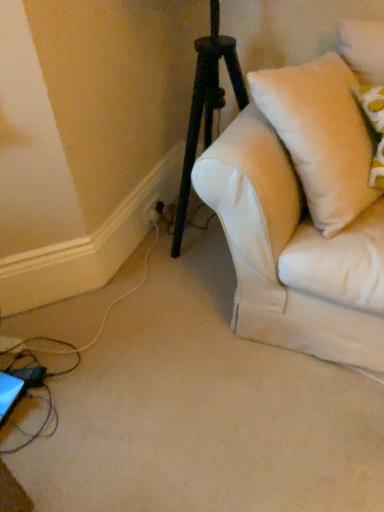
The height and width of the screenshot is (512, 384). I want to click on white plastic electric outlet at lower left, so pyautogui.click(x=153, y=210).

What do you see at coordinates (153, 210) in the screenshot?
I see `white plastic electric outlet at lower left` at bounding box center [153, 210].

What is the approximate width of white plastic electric outlet at lower left?

white plastic electric outlet at lower left is 0.79 inches in width.

At what (x,y) coordinates should I click in order to perform the action: click on white soft pillow at upper right. Please return your answer as a coordinate pair (x, y). The height and width of the screenshot is (512, 384). Looking at the image, I should click on (321, 136).

What do you see at coordinates (321, 136) in the screenshot? I see `white soft pillow at upper right` at bounding box center [321, 136].

The width and height of the screenshot is (384, 512). Find the location of `white plastic electric outlet at lower left`. white plastic electric outlet at lower left is located at coordinates (153, 210).

Consider the image. Between white plastic electric outlet at lower left and white soft pillow at upper right, which one appears on the left side from the viewer's perspective?

From the viewer's perspective, white plastic electric outlet at lower left appears more on the left side.

Is the depth of white plastic electric outlet at lower left less than that of white soft pillow at upper right?

No, white plastic electric outlet at lower left is further to the viewer.

Which point is more distant from viewer, (x=149, y=223) or (x=314, y=131)?

The point (x=149, y=223) is farther.

From the image's perspective, is white plastic electric outlet at lower left below white soft pillow at upper right?

Correct, white plastic electric outlet at lower left appears lower than white soft pillow at upper right in the image.

From a real-world perspective, is white plastic electric outlet at lower left located beneath white soft pillow at upper right?

Yes, from a real-world perspective, white plastic electric outlet at lower left is under white soft pillow at upper right.

Considering the sizes of objects white plastic electric outlet at lower left and white soft pillow at upper right in the image provided, who is thinner, white plastic electric outlet at lower left or white soft pillow at upper right?

white plastic electric outlet at lower left.

Is white plastic electric outlet at lower left shorter than white soft pillow at upper right?

Indeed, white plastic electric outlet at lower left has a lesser height compared to white soft pillow at upper right.

Considering the relative sizes of white plastic electric outlet at lower left and white soft pillow at upper right in the image provided, is white plastic electric outlet at lower left smaller than white soft pillow at upper right?

Yes.

Is white plastic electric outlet at lower left positioned beyond the bounds of white soft pillow at upper right?

Yes.

Consider the image. Are white plastic electric outlet at lower left and white soft pillow at upper right beside each other?

white plastic electric outlet at lower left is not next to white soft pillow at upper right, and they're not touching.

Is white soft pillow at upper right at the back of white plastic electric outlet at lower left?

No.

How many degrees apart are the facing directions of white plastic electric outlet at lower left and white soft pillow at upper right?

The angular difference between white plastic electric outlet at lower left and white soft pillow at upper right is 10.3 degrees.

Measure the distance from white plastic electric outlet at lower left to white soft pillow at upper right.

white plastic electric outlet at lower left is 3.48 feet from white soft pillow at upper right.

I want to click on electric outlet directly beneath the white soft pillow at upper right (from a real-world perspective), so [153, 210].

Which is more to the right, white soft pillow at upper right or white plastic electric outlet at lower left?

From the viewer's perspective, white soft pillow at upper right appears more on the right side.

Which object is closer to the camera, white soft pillow at upper right or white plastic electric outlet at lower left?

white soft pillow at upper right is more forward.

Which point is more forward, (260, 77) or (153, 219)?

The point (260, 77) is more forward.

From the picture: From the image's perspective, is white soft pillow at upper right located above white plastic electric outlet at lower left?

Correct, white soft pillow at upper right appears higher than white plastic electric outlet at lower left in the image.

From a real-world perspective, is white soft pillow at upper right on top of white plastic electric outlet at lower left?

Indeed, from a real-world perspective, white soft pillow at upper right stands above white plastic electric outlet at lower left.

Does white soft pillow at upper right have a lesser width compared to white plastic electric outlet at lower left?

No, white soft pillow at upper right is not thinner than white plastic electric outlet at lower left.

Can you confirm if white soft pillow at upper right is taller than white plastic electric outlet at lower left?

Yes.

Looking at the image, does white soft pillow at upper right seem bigger or smaller compared to white plastic electric outlet at lower left?

In the image, white soft pillow at upper right appears to be larger than white plastic electric outlet at lower left.

Based on the photo, is white soft pillow at upper right surrounding white plastic electric outlet at lower left?

No.

Would you consider white soft pillow at upper right to be distant from white plastic electric outlet at lower left?

Yes, white soft pillow at upper right is far from white plastic electric outlet at lower left.

In the scene shown: Does white soft pillow at upper right turn towards white plastic electric outlet at lower left?

No, white soft pillow at upper right is not turned towards white plastic electric outlet at lower left.

Measure the distance between white soft pillow at upper right and white plastic electric outlet at lower left.

3.48 feet.

You are a GUI agent. You are given a task and a screenshot of the screen. Output one action in this format:
    pyautogui.click(x=<x>, y=<y>)
    Task: Click on the pillow in front of the white plastic electric outlet at lower left
    The image size is (384, 512).
    Given the screenshot: What is the action you would take?
    (x=321, y=136)

The width and height of the screenshot is (384, 512). I want to click on pillow in front of the white plastic electric outlet at lower left, so click(x=321, y=136).

What are the coordinates of `pillow located above the white plastic electric outlet at lower left (from a real-world perspective)` in the screenshot? It's located at (321, 136).